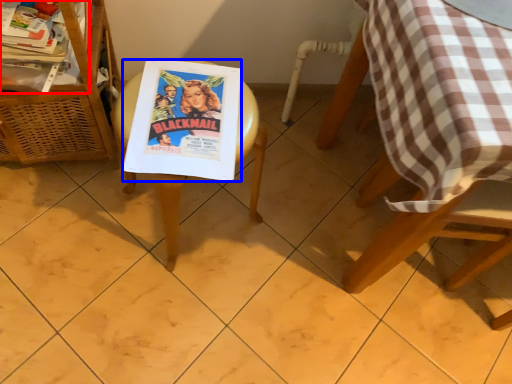
Question: Which of the following is the farthest to the observer, magazine (highlighted by a red box) or comic book (highlighted by a blue box)?

Choices:
 (A) magazine
 (B) comic book

Answer: (A)